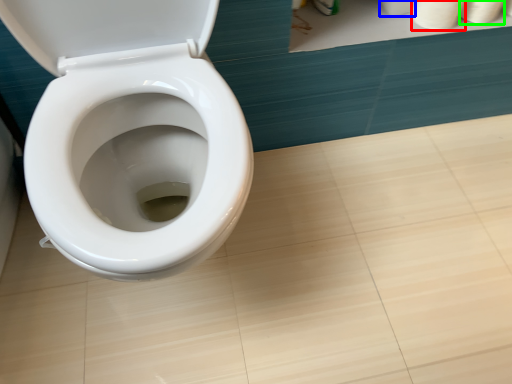
Question: Estimate the real-world distances between objects in this image. Which object is closer to toilet paper (highlighted by a red box), toilet paper (highlighted by a blue box) or toilet paper (highlighted by a green box)?

Choices:
 (A) toilet paper
 (B) toilet paper

Answer: (B)